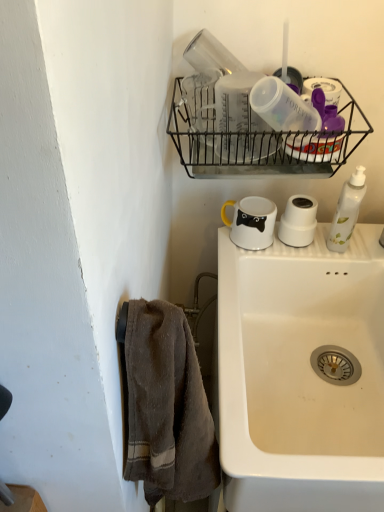
Where is `free space on the front side of white glossy mug at upper center`? The image size is (384, 512). free space on the front side of white glossy mug at upper center is located at coordinates (245, 259).